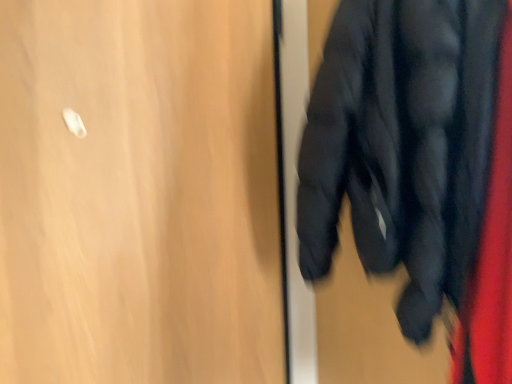
Question: Does wooden door at upper left have a greater height compared to matte black jacket at right?

Choices:
 (A) no
 (B) yes

Answer: (B)

Question: From a real-world perspective, is wooden door at upper left located higher than matte black jacket at right?

Choices:
 (A) yes
 (B) no

Answer: (B)

Question: Is wooden door at upper left bigger than matte black jacket at right?

Choices:
 (A) no
 (B) yes

Answer: (A)

Question: Is wooden door at upper left at the right side of matte black jacket at right?

Choices:
 (A) yes
 (B) no

Answer: (B)

Question: Considering the relative sizes of wooden door at upper left and matte black jacket at right in the image provided, is wooden door at upper left smaller than matte black jacket at right?

Choices:
 (A) no
 (B) yes

Answer: (B)

Question: Considering the relative sizes of wooden door at upper left and matte black jacket at right in the image provided, is wooden door at upper left wider than matte black jacket at right?

Choices:
 (A) no
 (B) yes

Answer: (A)

Question: Is matte black jacket at right bigger than wooden door at upper left?

Choices:
 (A) yes
 (B) no

Answer: (A)

Question: Would you say matte black jacket at right is a long distance from wooden door at upper left?

Choices:
 (A) yes
 (B) no

Answer: (B)

Question: Can you see matte black jacket at right touching wooden door at upper left?

Choices:
 (A) yes
 (B) no

Answer: (B)

Question: From a real-world perspective, is matte black jacket at right beneath wooden door at upper left?

Choices:
 (A) yes
 (B) no

Answer: (B)

Question: Can you confirm if matte black jacket at right is smaller than wooden door at upper left?

Choices:
 (A) no
 (B) yes

Answer: (A)

Question: Is matte black jacket at right positioned behind wooden door at upper left?

Choices:
 (A) no
 (B) yes

Answer: (A)

Question: Does point pyautogui.click(x=22, y=76) appear closer or farther from the camera than point pyautogui.click(x=394, y=253)?

Choices:
 (A) farther
 (B) closer

Answer: (A)